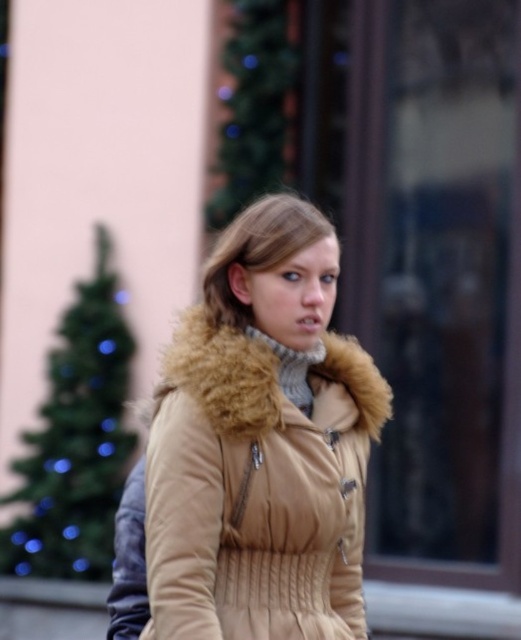
Does point (167, 624) come in front of point (230, 321)?

Yes, it is.

Is point (195, 552) in front of point (290, 234)?

Yes, it is.

Identify the location of tan quilted coat at center. The image size is (521, 640). (262, 442).